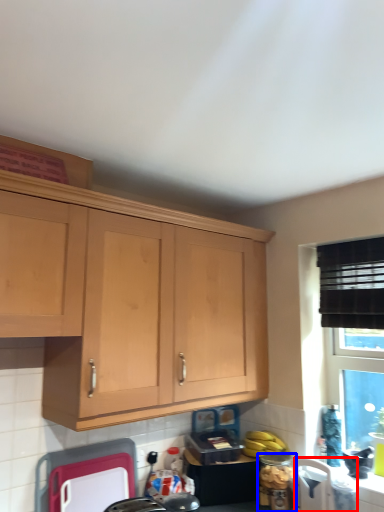
Question: Which of the following is the farthest to the observer, appliance (highlighted by a red box) or appliance (highlighted by a blue box)?

Choices:
 (A) appliance
 (B) appliance

Answer: (B)